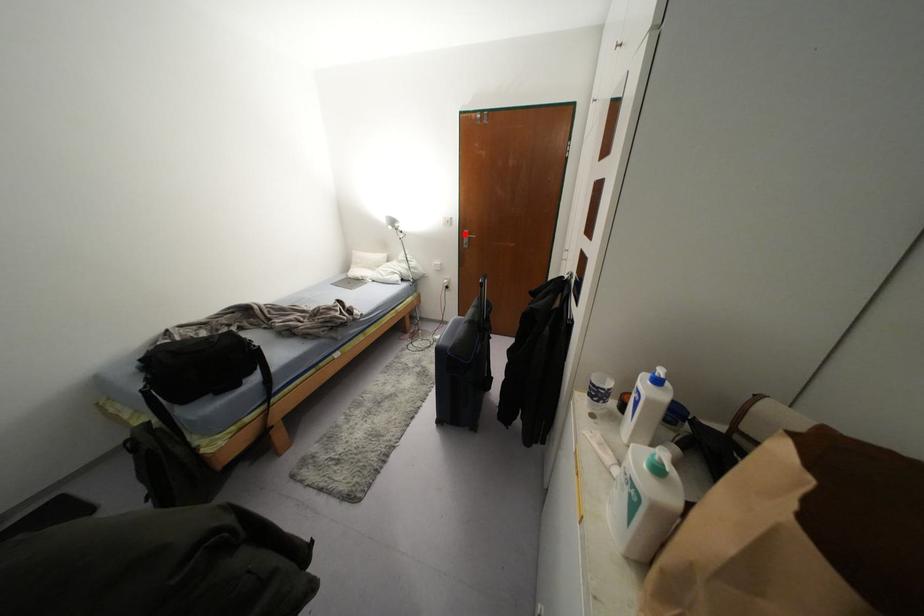
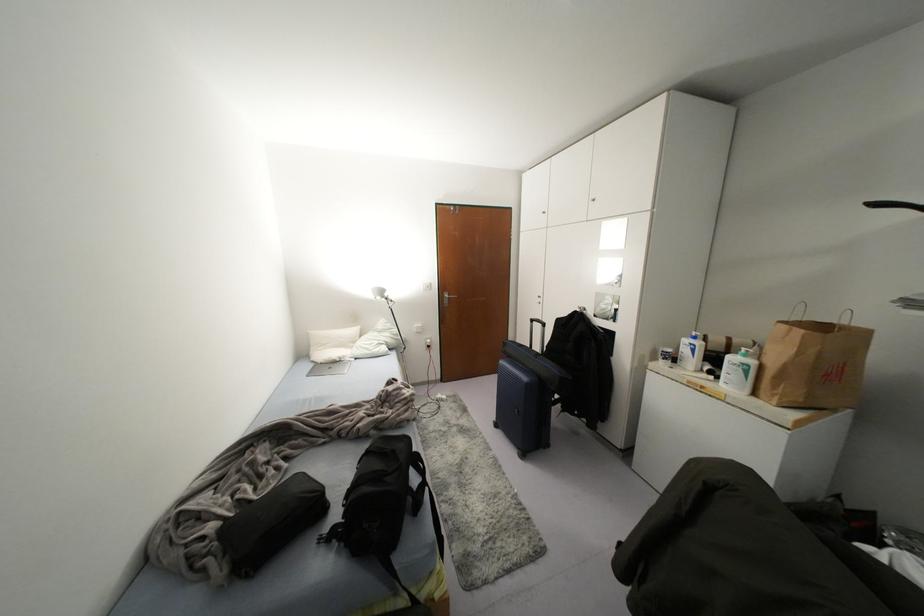
Where in the second image is the point corresponding to the highlighted location from the first image?

(445, 296)